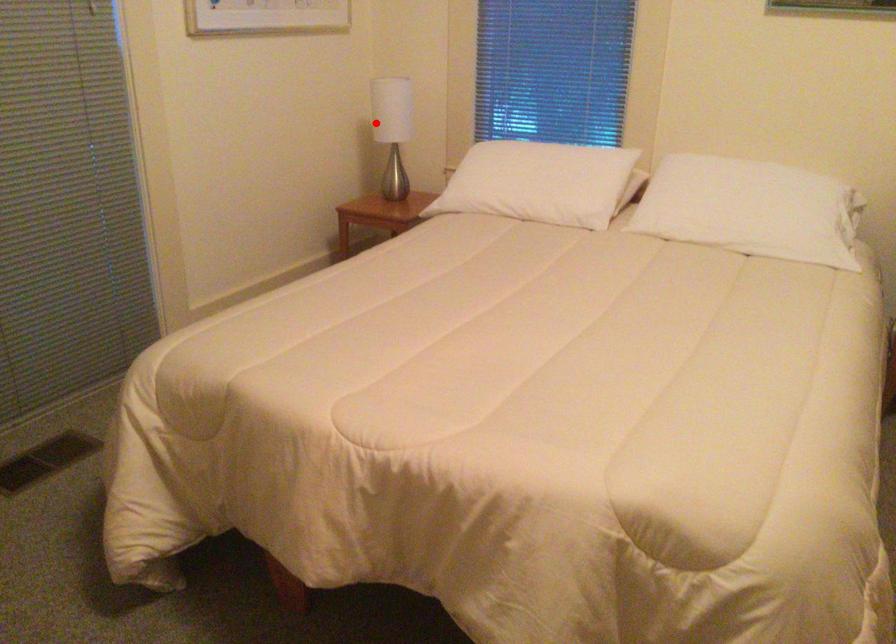
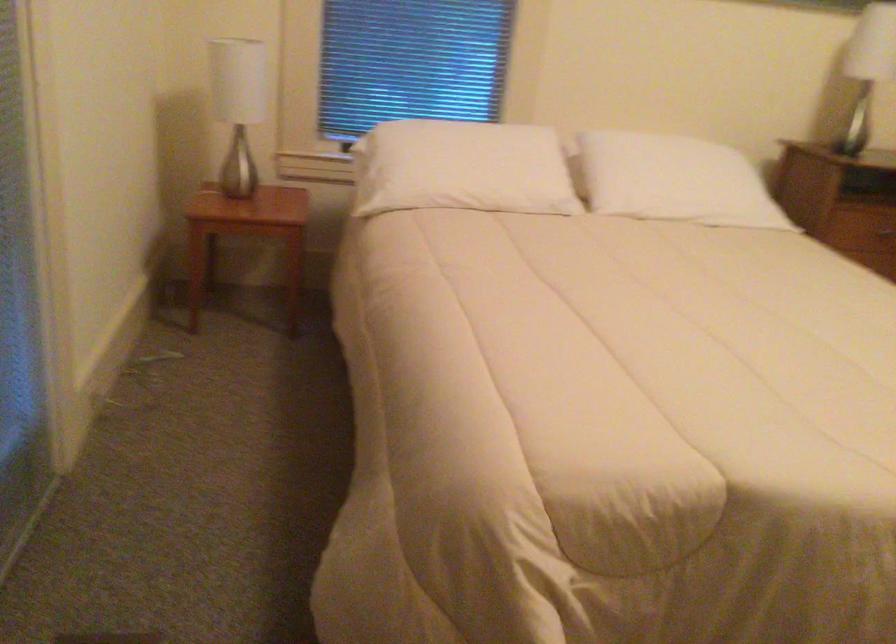
In the second image, find the point that corresponds to the highlighted location in the first image.

(238, 106)